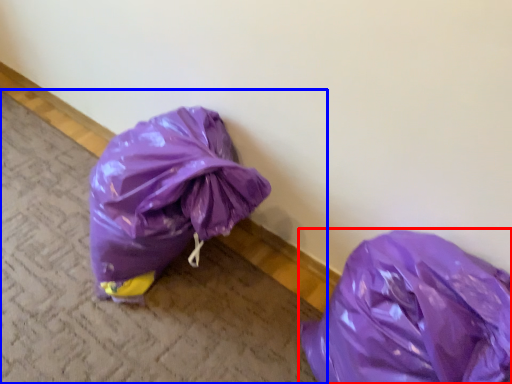
Question: Which point is further to the camera, plastic bag (highlighted by a red box) or pavement (highlighted by a blue box)?

Choices:
 (A) plastic bag
 (B) pavement

Answer: (B)